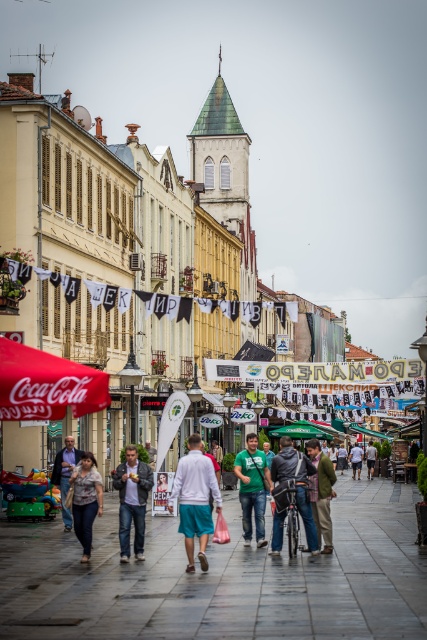
You are a tailor observing two shirts in the center of a European town square. The shirts are both placed on a rack. If you were to fold them, which shirt would require less space due to its material and thickness? Please refer to the green matte shirt at center and the white cotton shirt at center in your answer.

The green matte shirt at center is thinner than the white cotton shirt at center, so it would require less space when folded.

You are a photographer standing on the street and want to take a photo of both the green matte shirt at center and the white cotton shirt at center. Which shirt should you focus on first to ensure both are in sharp focus?

You should focus on the green matte shirt at center first since it is closer to the viewer than the white cotton shirt at center, ensuring both are in focus by adjusting the camera settings accordingly.